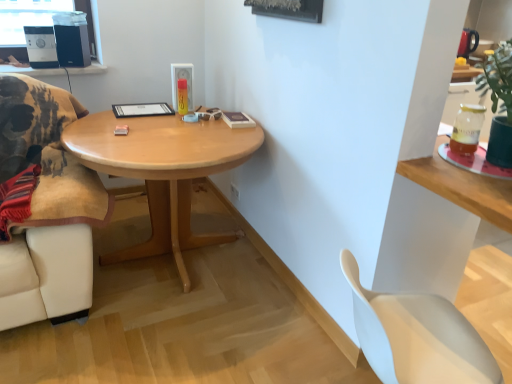
Question: Is translucent glass jar at upper right at the back of matte black speaker at upper left, the 1th speaker viewed from the left?

Choices:
 (A) no
 (B) yes

Answer: (A)

Question: From a real-world perspective, is matte black speaker at upper left, the second speaker in the right-to-left sequence, under translucent glass jar at upper right?

Choices:
 (A) no
 (B) yes

Answer: (A)

Question: Can you confirm if matte black speaker at upper left, the second speaker in the right-to-left sequence, is positioned to the left of translucent glass jar at upper right?

Choices:
 (A) yes
 (B) no

Answer: (A)

Question: Is the depth of matte black speaker at upper left, the 1th speaker viewed from the left, greater than that of translucent glass jar at upper right?

Choices:
 (A) yes
 (B) no

Answer: (A)

Question: From a real-world perspective, does matte black speaker at upper left, the 1th speaker viewed from the left, stand above translucent glass jar at upper right?

Choices:
 (A) yes
 (B) no

Answer: (A)

Question: In terms of width, does black matte speaker at upper left, which is the first speaker from right to left, look wider or thinner when compared to white plastic chair at lower right?

Choices:
 (A) thin
 (B) wide

Answer: (A)

Question: Which is correct: black matte speaker at upper left, which is the first speaker from right to left, is inside white plastic chair at lower right, or outside of it?

Choices:
 (A) inside
 (B) outside

Answer: (B)

Question: From the image's perspective, is black matte speaker at upper left, which is the first speaker from right to left, located above or below white plastic chair at lower right?

Choices:
 (A) above
 (B) below

Answer: (A)

Question: In the image, is black matte speaker at upper left, positioned as the 2th speaker in left-to-right order, positioned in front of or behind white plastic chair at lower right?

Choices:
 (A) behind
 (B) front

Answer: (A)

Question: Looking at the image, does white plastic chair at lower right seem bigger or smaller compared to translucent glass jar at upper right?

Choices:
 (A) small
 (B) big

Answer: (B)

Question: From the image's perspective, is white plastic chair at lower right above or below translucent glass jar at upper right?

Choices:
 (A) above
 (B) below

Answer: (B)

Question: Considering the positions of white plastic chair at lower right and translucent glass jar at upper right in the image, is white plastic chair at lower right taller or shorter than translucent glass jar at upper right?

Choices:
 (A) short
 (B) tall

Answer: (B)

Question: Based on their positions, is white plastic chair at lower right located to the left or right of translucent glass jar at upper right?

Choices:
 (A) left
 (B) right

Answer: (A)

Question: Is point (457, 129) closer or farther from the camera than point (59, 43)?

Choices:
 (A) closer
 (B) farther

Answer: (A)

Question: Is translucent glass jar at upper right wider or thinner than black matte speaker at upper left, which is the first speaker from right to left?

Choices:
 (A) thin
 (B) wide

Answer: (A)